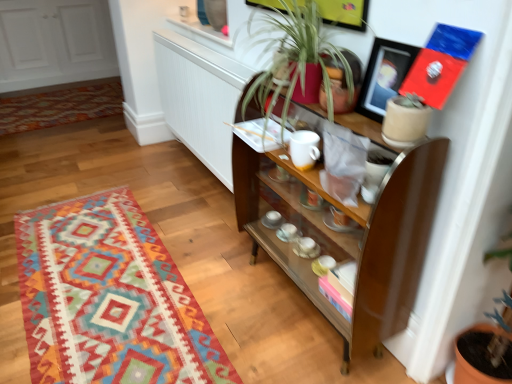
Locate an element on the screen. vacant area on the back side of textured wool rug at lower left, the 2th mat when ordered from back to front is located at coordinates (125, 183).